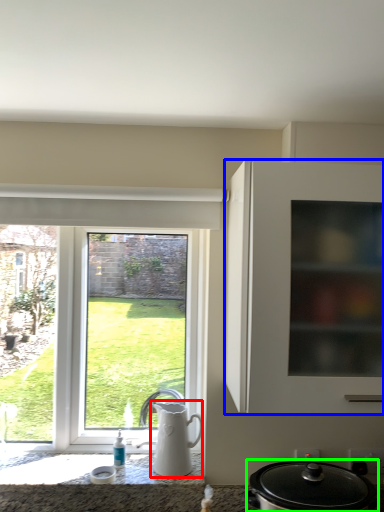
Question: Which object is the farthest from jug (highlighted by a red box)? Choose among these: cabinetry (highlighted by a blue box) or kitchen appliance (highlighted by a green box).

Choices:
 (A) cabinetry
 (B) kitchen appliance

Answer: (A)